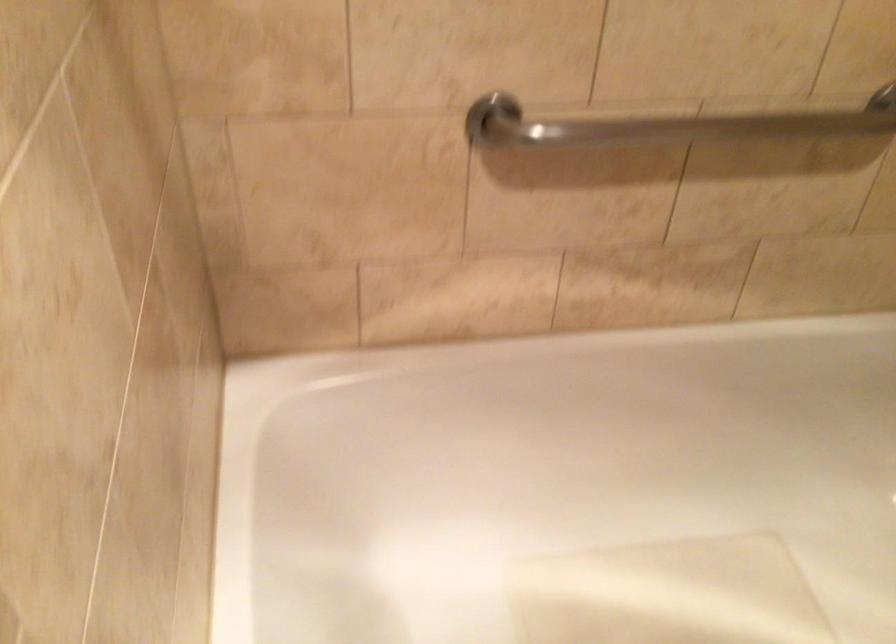
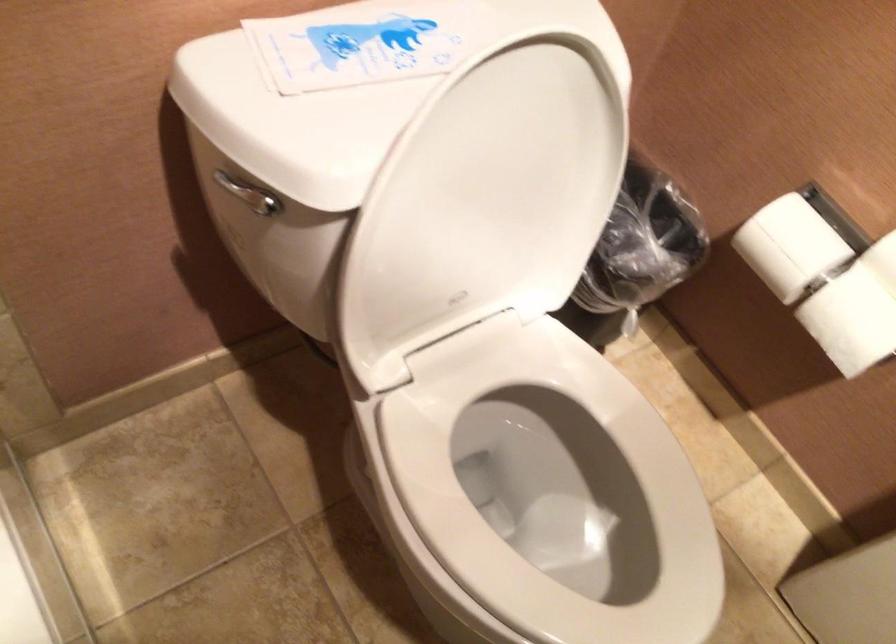
The first image is from the beginning of the video and the second image is from the end. How did the camera likely rotate when shooting the video?

The camera rotated toward right-down.